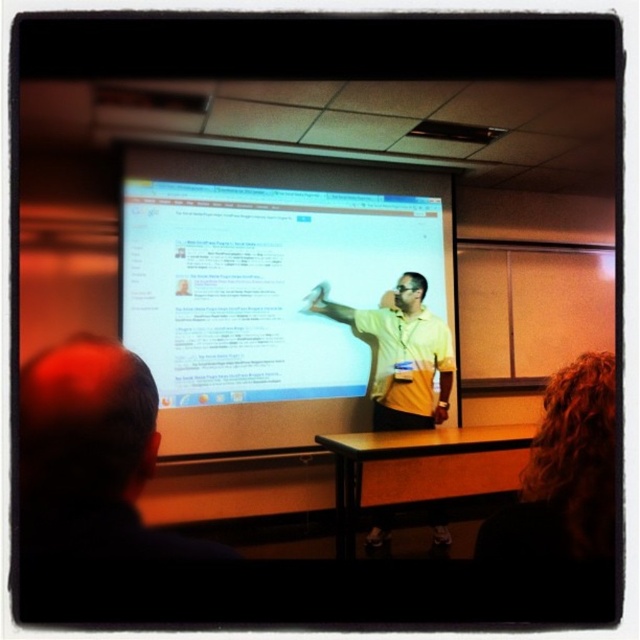
Is white glossy projection screen at center further to the viewer compared to yellow matte shirt at center?

No, white glossy projection screen at center is in front of yellow matte shirt at center.

Does point (304, 349) come farther from viewer compared to point (408, 305)?

Yes, it is behind point (408, 305).

Is point (314, 365) positioned after point (436, 328)?

Yes, it is.

Identify the location of white glossy projection screen at center. (266, 288).

Which of these two, white glossy projection screen at center or curly hair at upper right, stands taller?

white glossy projection screen at center

This screenshot has width=640, height=640. Describe the element at coordinates (266, 288) in the screenshot. I see `white glossy projection screen at center` at that location.

Is point (372, 307) closer to camera compared to point (563, 483)?

No, (372, 307) is further to viewer.

The width and height of the screenshot is (640, 640). I want to click on white glossy projection screen at center, so click(266, 288).

Between curly hair at upper right and yellow matte shirt at center, which one has less height?

With less height is curly hair at upper right.

Does curly hair at upper right lie behind yellow matte shirt at center?

No.

Is point (595, 381) positioned before point (413, 339)?

Yes, point (595, 381) is in front of point (413, 339).

Find the location of a particular element. Image resolution: width=640 pixels, height=640 pixels. curly hair at upper right is located at coordinates (561, 504).